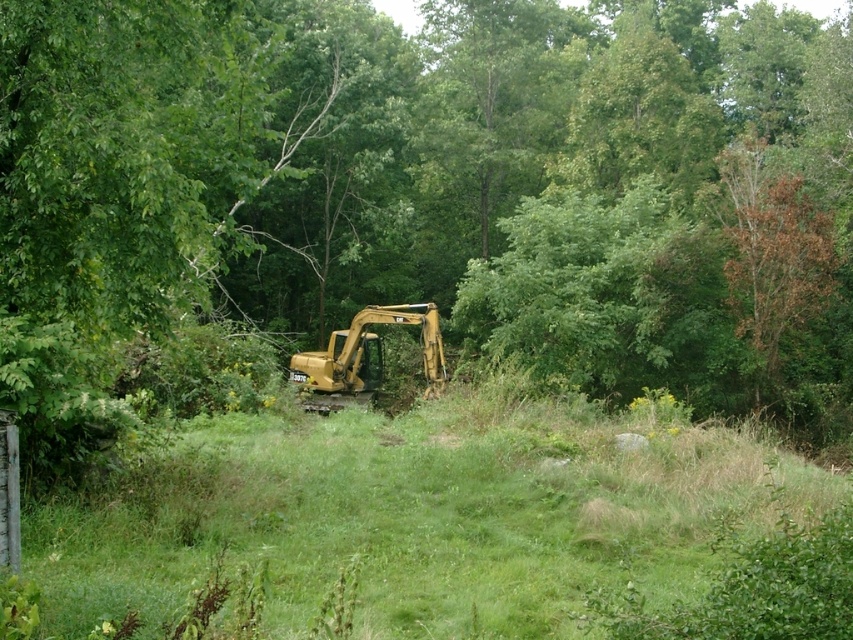
Based on the photo, you are a construction worker planning to move a heavy equipment from the yellow metallic excavator at center to the green grass at center. Can you safely move it if the minimum safe distance required is 10 meters?

The green grass at center and yellow metallic excavator at center are 9.83 meters apart. Since the minimum safe distance required is 10 meters, the distance is insufficient. Therefore, moving the equipment is not safe.